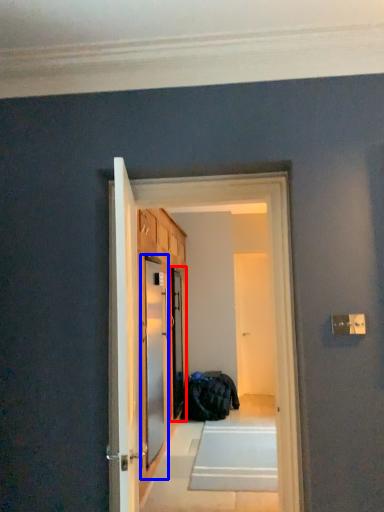
Question: Which of the following is the closest to the observer, screen door (highlighted by a red box) or screen door (highlighted by a blue box)?

Choices:
 (A) screen door
 (B) screen door

Answer: (B)